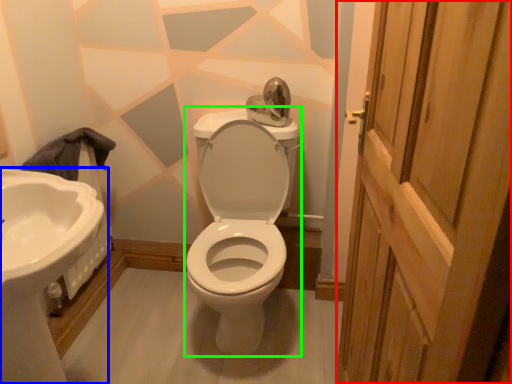
Question: Based on their relative distances, which object is nearer to screen door (highlighted by a red box)? Choose from sink (highlighted by a blue box) and porcelain (highlighted by a green box).

Choices:
 (A) sink
 (B) porcelain

Answer: (B)